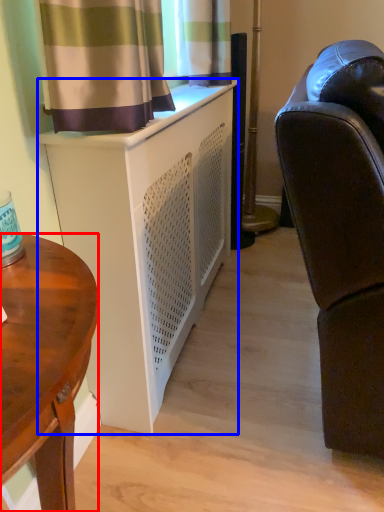
Question: Which object is closer to the camera taking this photo, desk (highlighted by a red box) or cabinetry (highlighted by a blue box)?

Choices:
 (A) desk
 (B) cabinetry

Answer: (A)